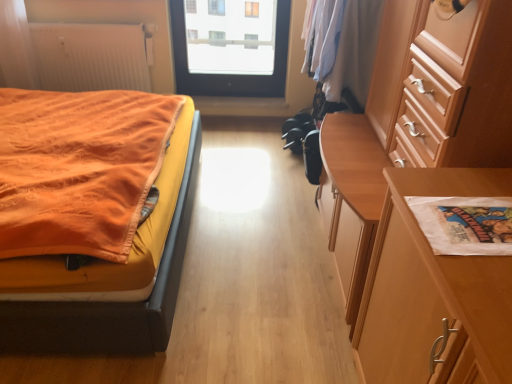
Find the location of `vacant region under transparent glass door at upper center (from a real-world perspective)`. vacant region under transparent glass door at upper center (from a real-world perspective) is located at coordinates (231, 96).